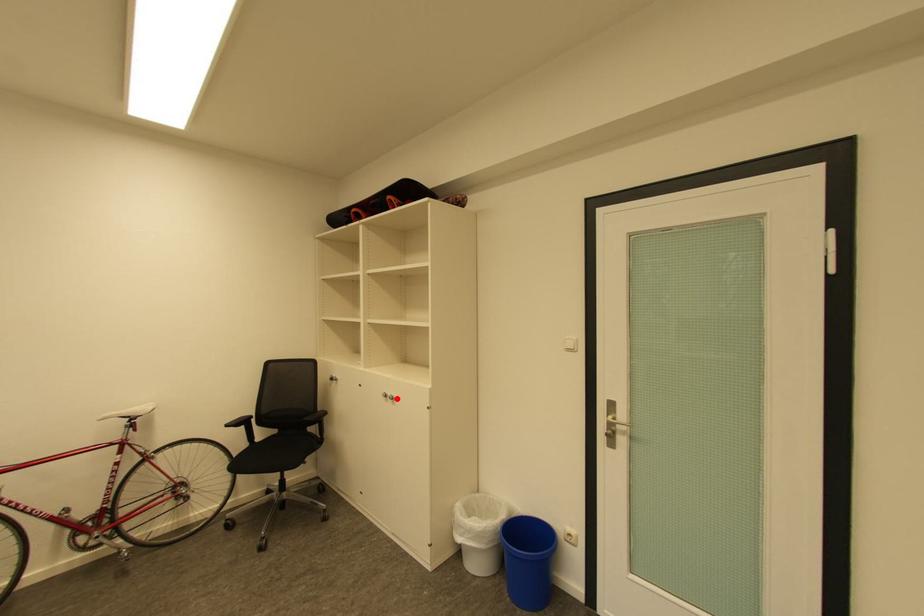
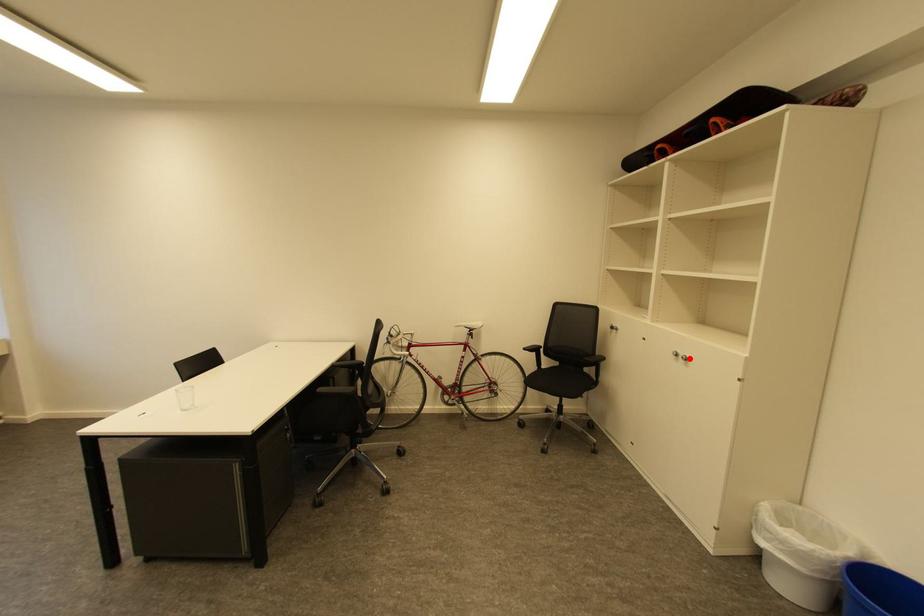
I am providing you with two images of the same scene from different viewpoints. A red point is marked on the first image and another point is marked on the second image. Do the highlighted points in image1 and image2 indicate the same real-world spot?

Yes